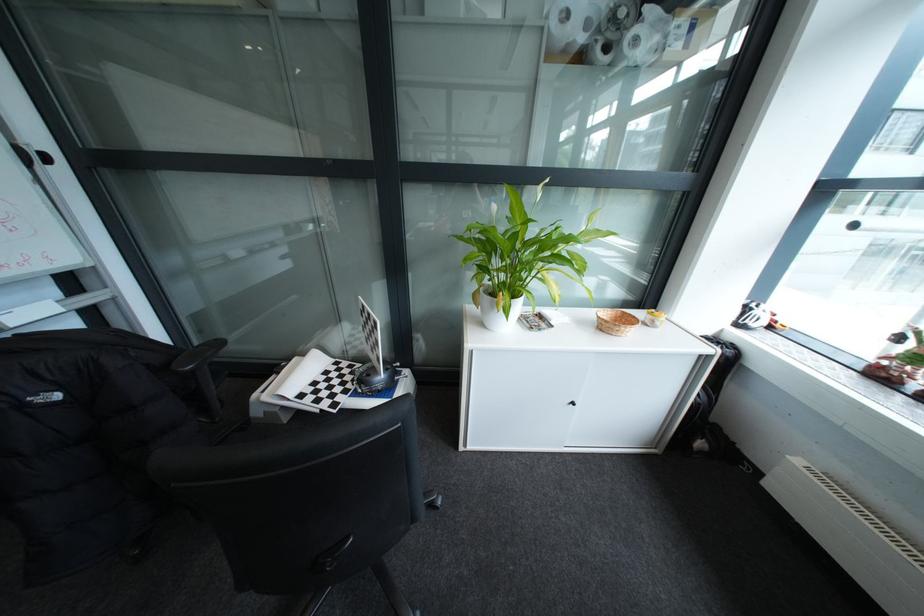
Describe the element at coordinates (199, 355) in the screenshot. I see `a black chair armrest` at that location.